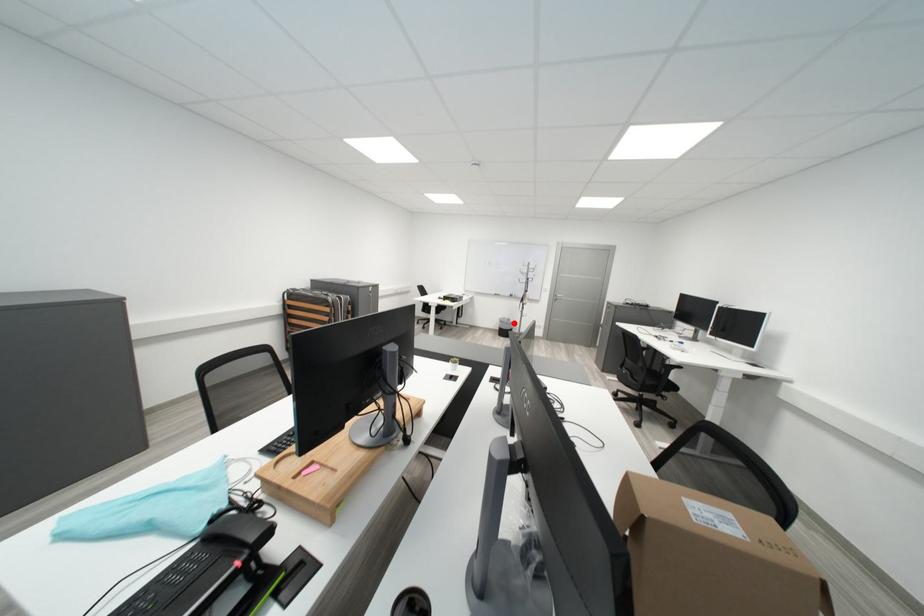
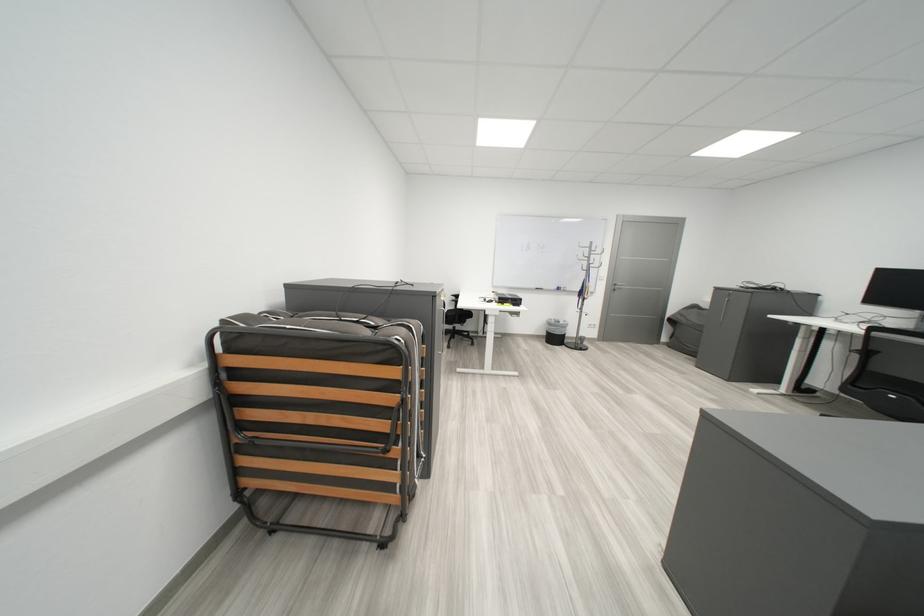
Where in the second image is the point corresponding to the highlighted location from the first image?

(563, 326)